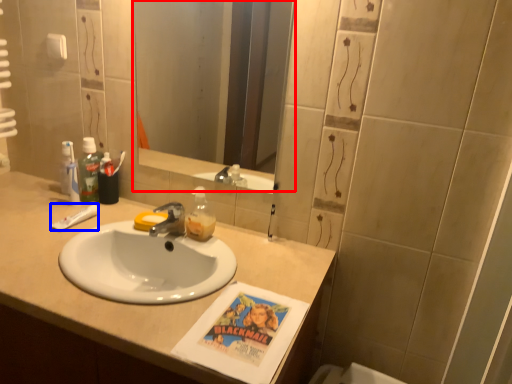
Question: Which of the following is the closest to the observer, mirror (highlighted by a red box) or toothpaste (highlighted by a blue box)?

Choices:
 (A) mirror
 (B) toothpaste

Answer: (A)